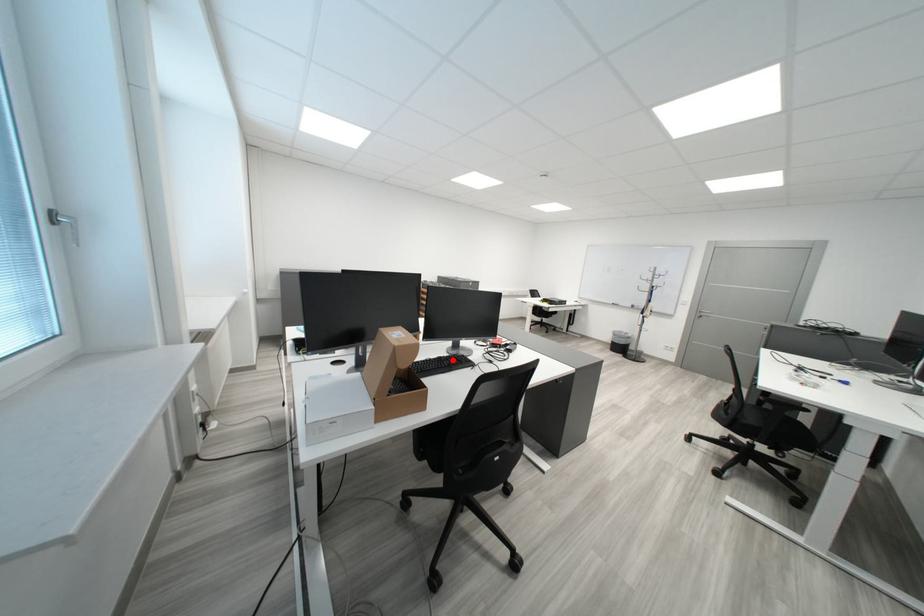
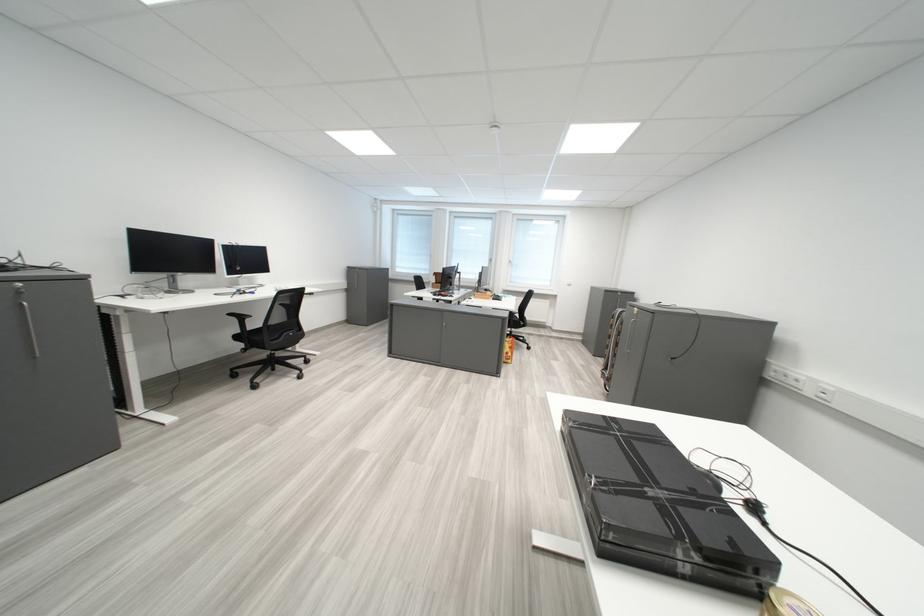
Question: I am providing you with two images of the same scene from different viewpoints. A red point is marked on the first image. At the location where the point appears in image 1, is it still visible in image 2?

Choices:
 (A) Yes
 (B) No

Answer: (B)